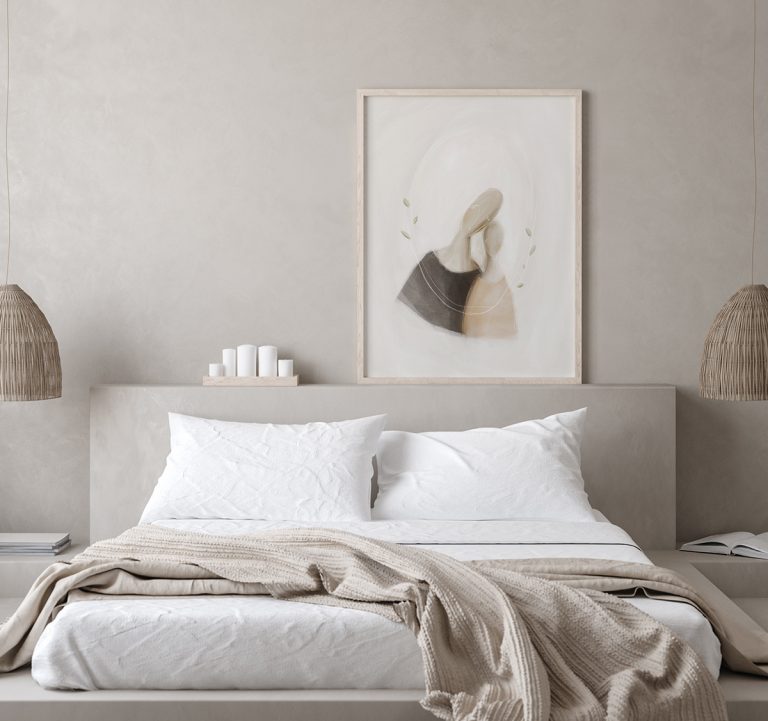
Find the location of a particular element. This screenshot has width=768, height=721. cords is located at coordinates (7, 102), (753, 81).